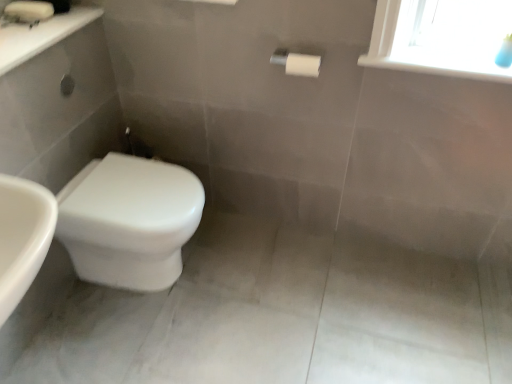
Question: Is white glossy sink at upper left taller or shorter than white plastic window sill at upper right?

Choices:
 (A) short
 (B) tall

Answer: (B)

Question: Is white glossy sink at upper left bigger or smaller than white plastic window sill at upper right?

Choices:
 (A) big
 (B) small

Answer: (A)

Question: Which object is positioned farthest from the white glossy toilet at lower left?

Choices:
 (A) white glossy sink at upper left
 (B) white plastic window sill at upper right

Answer: (B)

Question: Which object is the farthest from the white plastic window sill at upper right?

Choices:
 (A) white glossy toilet at lower left
 (B) white glossy sink at upper left

Answer: (B)